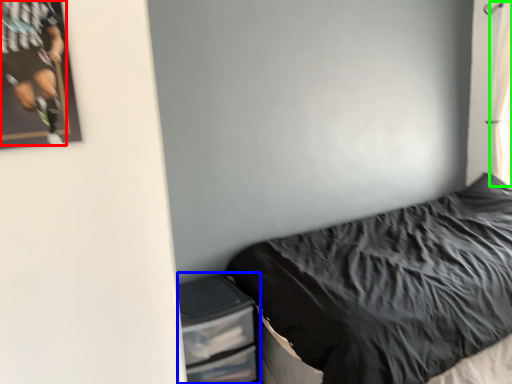
Question: Estimate the real-world distances between objects in this image. Which object is closer to person (highlighted by a red box), dresser (highlighted by a blue box) or curtain (highlighted by a green box)?

Choices:
 (A) dresser
 (B) curtain

Answer: (A)